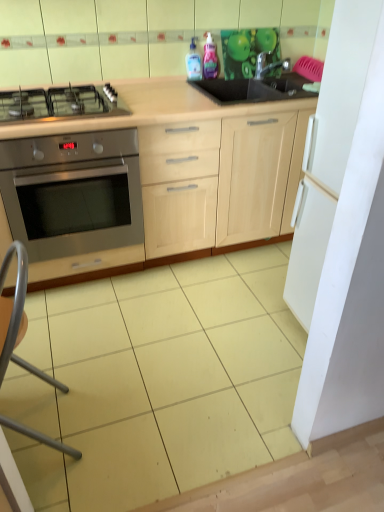
I want to click on vacant area situated to the left side of metallic faucet at upper right, so click(x=239, y=81).